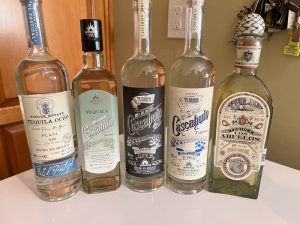
This screenshot has height=225, width=300. I want to click on the front of pantry door, so click(61, 23).